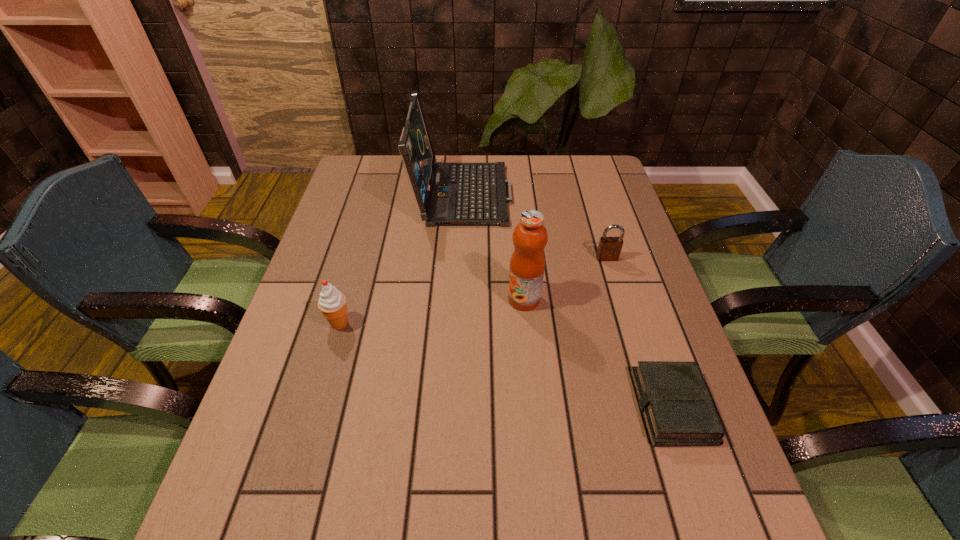
The image size is (960, 540). I want to click on vacant point located on the front label of the third farthest object, so click(408, 299).

The height and width of the screenshot is (540, 960). Find the location of `vacant space located on the front label of the third farthest object`. vacant space located on the front label of the third farthest object is located at coordinates (448, 299).

The image size is (960, 540). Identify the location of blank space located on the right of the icecream. (515, 323).

Find the location of a particular element. free spot located 0.370m on the front-facing side of the padlock is located at coordinates (643, 379).

Locate an element on the screen. The image size is (960, 540). vacant space situated 0.110m on the back of the shortest object is located at coordinates (647, 331).

Identify the location of object that is at the far edge. (447, 193).

You are a GUI agent. You are given a task and a screenshot of the screen. Output one action in this format:
    pyautogui.click(x=<x>, y=<y>)
    Task: Click on the object present at the left edge
    
    Given the screenshot: What is the action you would take?
    pyautogui.click(x=332, y=303)

Identify the location of padlock that is at the right edge. (609, 248).

Where is `book that is positioned at the right edge`? book that is positioned at the right edge is located at coordinates (678, 411).

In the image, there is a desktop. Identify the location of vacant space at the far edge. (545, 158).